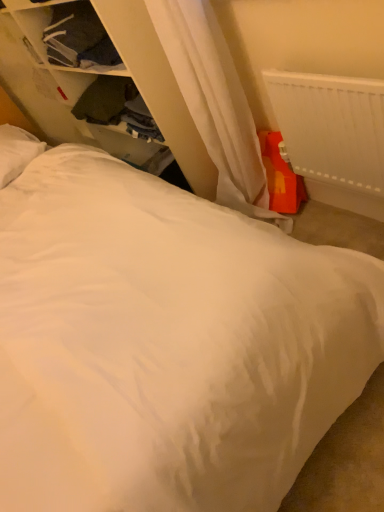
Question: Does point (370, 146) appear closer or farther from the camera than point (127, 82)?

Choices:
 (A) closer
 (B) farther

Answer: (A)

Question: In the image, is white plastic radiator at upper right on the left side or the right side of dark green fabric at upper left, positioned as the 2th clothing in top-to-bottom order?

Choices:
 (A) left
 (B) right

Answer: (B)

Question: Which is nearer to the white fabric dresser at upper left?

Choices:
 (A) white soft pillow at upper left
 (B) dark green fabric at upper left, positioned as the 2th clothing in top-to-bottom order
 (C) dark blue fabric at upper left, the 2th clothing positioned from the bottom
 (D) white plastic radiator at upper right

Answer: (B)

Question: Which object is positioned farthest from the dark green fabric at upper left, positioned as the 2th clothing in top-to-bottom order?

Choices:
 (A) dark blue fabric at upper left, placed as the first clothing when sorted from top to bottom
 (B) white plastic radiator at upper right
 (C) white soft pillow at upper left
 (D) white fabric dresser at upper left

Answer: (B)